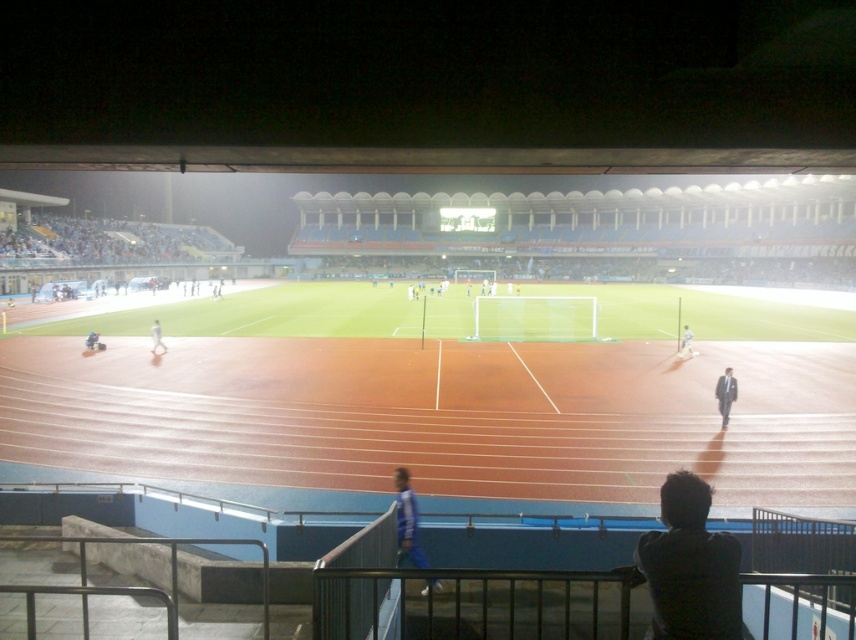
You are a photographer standing at the edge of the running track. You want to capture a photo that includes both the light blue fabric shirt at right and the white matte person at center. Which of the two objects should you focus on first to ensure they are both in clear view?

The light blue fabric shirt at right is smaller than the white matte person at center, so you should focus on the white matte person at center first to ensure both are in clear view.

You are a photographer positioned at the edge of the running track in the stadium. You want to take a photo of the dark gray suit at lower right without the blue fabric pants at lower center blocking it. Is this possible given their positions?

The blue fabric pants at lower center is in front of the dark gray suit at lower right, so it will block the view. To capture the dark gray suit at lower right without obstruction, you would need to reposition yourself to an angle where the blue fabric pants at lower center is no longer between you and the dark gray suit at lower right.

You are standing at the point labeled point (401, 476) in the stadium. You want to take a photo of the goalpost located at the center of the field. The camera you are using has a maximum focus range of 10 meters. Will the camera be able to focus on the goalpost from your current position?

The distance between point (401, 476) and the camera is 9.29 meters. Since the camera has a maximum focus range of 10 meters, it can focus on the goalpost from this position as the distance is within the limit.